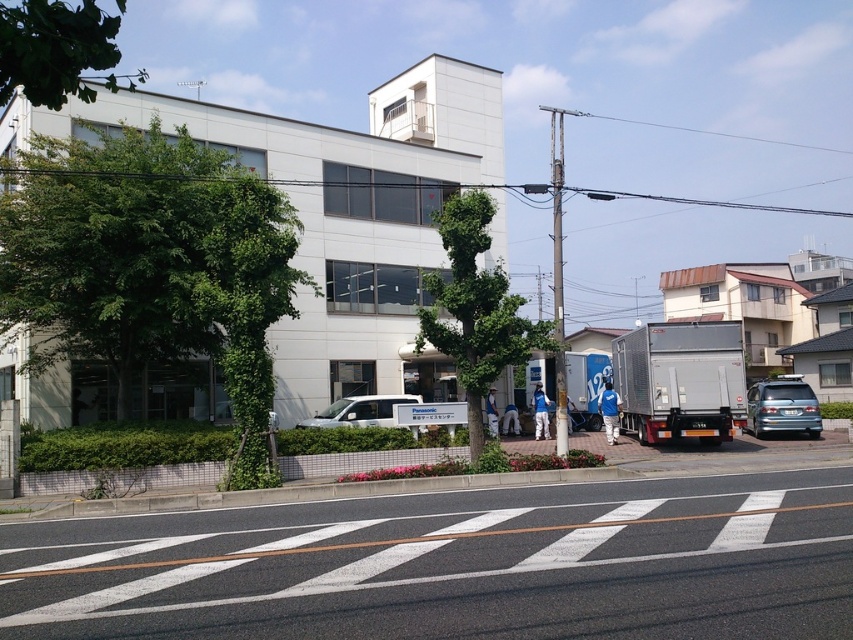
You are standing at the point marked by the coordinate point at (474, 308). What object is directly in front of you?

The point at (474, 308) indicates a green leafy tree at center, so the object directly in front of you is the green leafy tree at center.

You are a pedestrian standing at the entrance of the building. You want to walk to the silver metallic truck at right but need to pass by the green leafy tree at center. In which direction should you turn to go around the tree and reach the truck?

You should turn to the right to go around the green leafy tree at center, as it is positioned to the left of the silver metallic truck at right. This way, you can navigate around the tree and head towards the truck.